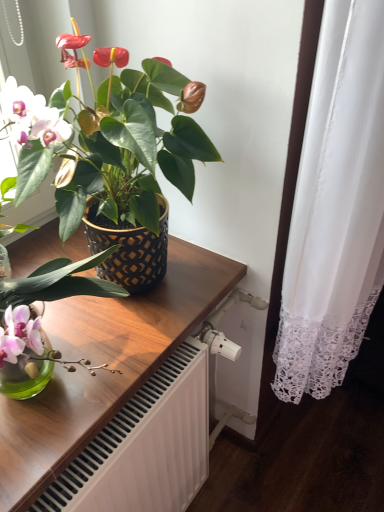
Question: From the image's perspective, does matte black pot at upper left appear higher than wooden table at center?

Choices:
 (A) yes
 (B) no

Answer: (A)

Question: Does matte black pot at upper left have a greater height compared to wooden table at center?

Choices:
 (A) yes
 (B) no

Answer: (A)

Question: Is matte black pot at upper left closer to camera compared to wooden table at center?

Choices:
 (A) yes
 (B) no

Answer: (A)

Question: Can you confirm if matte black pot at upper left is bigger than wooden table at center?

Choices:
 (A) no
 (B) yes

Answer: (B)

Question: Can you confirm if matte black pot at upper left is thinner than wooden table at center?

Choices:
 (A) no
 (B) yes

Answer: (A)

Question: Is matte black pot at upper left facing away from wooden table at center?

Choices:
 (A) no
 (B) yes

Answer: (A)

Question: Does wooden table at center have a larger size compared to matte black pot at upper left?

Choices:
 (A) yes
 (B) no

Answer: (B)

Question: Is wooden table at center to the left of matte black pot at upper left from the viewer's perspective?

Choices:
 (A) yes
 (B) no

Answer: (A)

Question: Is wooden table at center not inside matte black pot at upper left?

Choices:
 (A) no
 (B) yes

Answer: (A)

Question: Does wooden table at center come behind matte black pot at upper left?

Choices:
 (A) no
 (B) yes

Answer: (B)

Question: Can matte black pot at upper left be found inside wooden table at center?

Choices:
 (A) no
 (B) yes

Answer: (A)

Question: From the image's perspective, is wooden table at center on matte black pot at upper left?

Choices:
 (A) yes
 (B) no

Answer: (B)

Question: From their relative heights in the image, would you say wooden table at center is taller or shorter than matte black pot at upper left?

Choices:
 (A) short
 (B) tall

Answer: (A)